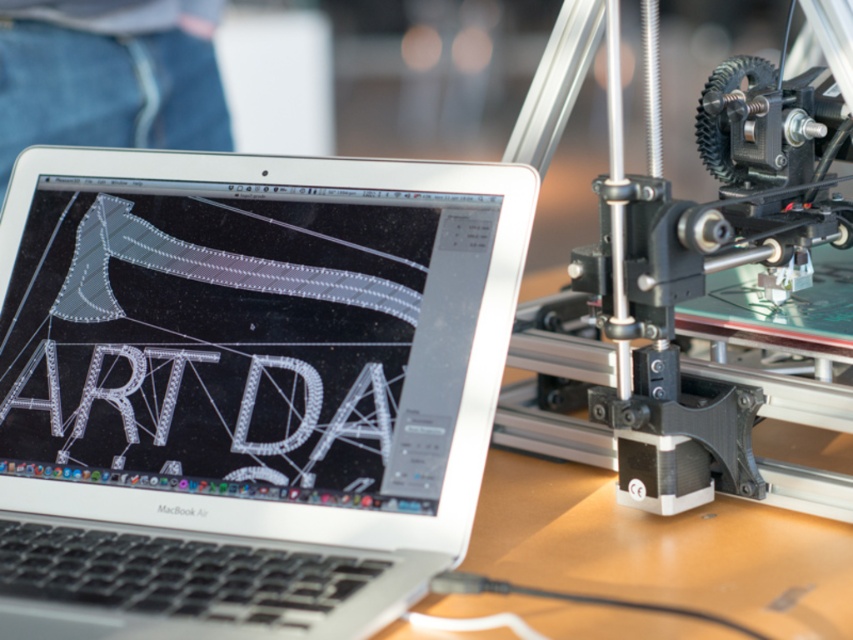
Question: Which point is closer to the camera?

Choices:
 (A) (663, 392)
 (B) (184, 595)

Answer: (B)

Question: Among these objects, which one is nearest to the camera?

Choices:
 (A) white metallic letters at center
 (B) silver/black laptop at center

Answer: (B)

Question: Among these points, which one is nearest to the camera?

Choices:
 (A) (64, 580)
 (B) (215, 429)

Answer: (A)

Question: Is the position of silver/black laptop at center more distant than that of black matte 3d printer head at right?

Choices:
 (A) no
 (B) yes

Answer: (A)

Question: Is silver/black laptop at center below white metallic letters at center?

Choices:
 (A) no
 (B) yes

Answer: (A)

Question: Is silver/black laptop at center closer to the viewer compared to black matte 3d printer head at right?

Choices:
 (A) no
 (B) yes

Answer: (B)